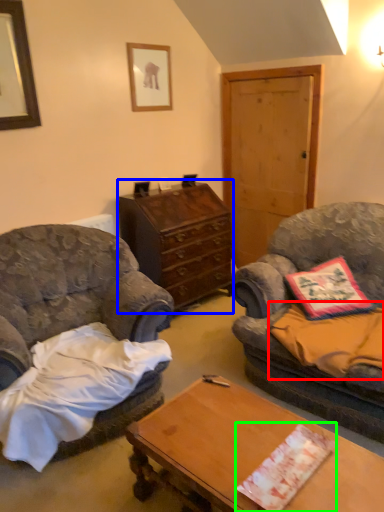
Question: Considering the real-world distances, which object is farthest from sheet (highlighted by a red box)? cabinetry (highlighted by a blue box) or sheet (highlighted by a green box)?

Choices:
 (A) cabinetry
 (B) sheet

Answer: (A)